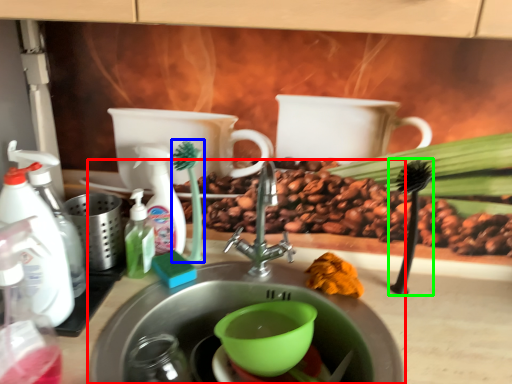
Question: Which object is the farthest from sink (highlighted by a red box)? Choose among these: plant (highlighted by a blue box) or plant (highlighted by a green box).

Choices:
 (A) plant
 (B) plant

Answer: (B)